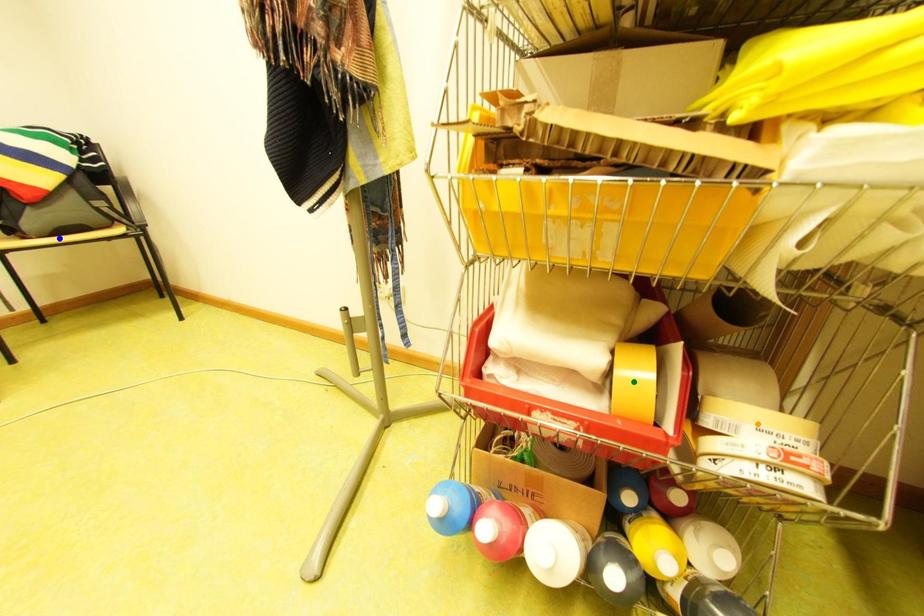
Order these from nearest to farthest:
A) orange point
B) blue point
C) green point

1. blue point
2. green point
3. orange point